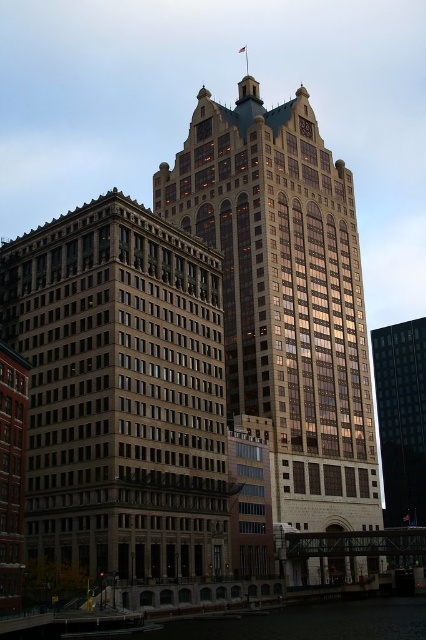
In the scene shown: You are a photographer standing in the middle of the city square. You want to capture a photo of the clear water at lower center and the gold glass skyscraper at center. Which object should you position closer to the front of your camera frame to ensure both are visible?

To ensure both the clear water at lower center and the gold glass skyscraper at center are visible, you should position the gold glass skyscraper at center closer to the front of your camera frame since the clear water at lower center is behind it.

You are standing in front of the brown stone building at center and want to see the clear water at lower center. Can you see it without moving your position?

The clear water at lower center is behind the brown stone building at center, so you cannot see it from your current position in front of the brown stone building at center.

You are an architect planning to install a large banner between the two buildings. Given that the brown stone building at center is wider than the black glass building at right, which building should you choose as the anchor point for the banner to ensure it spans the entire width between them?

You should anchor the banner to the brown stone building at center because its width is larger than the black glass building at right, allowing the banner to span the entire distance between them.